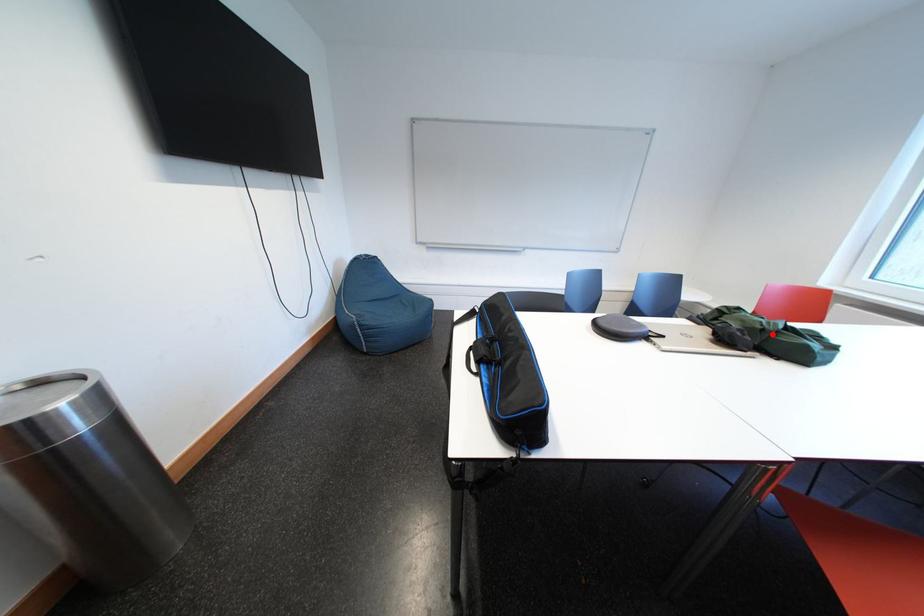
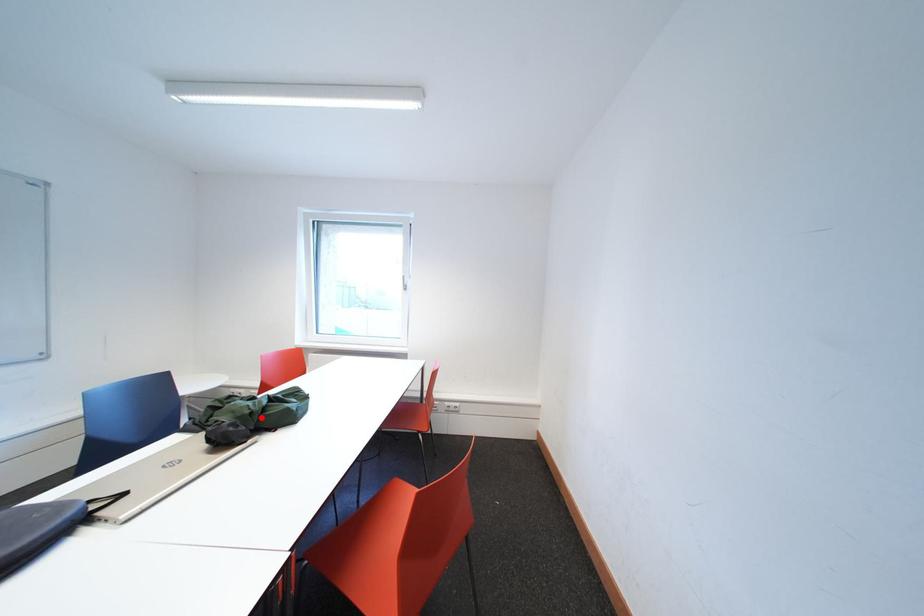
I am providing you with two images of the same scene from different viewpoints. A red point is marked on the first image and another point is marked on the second image. Are the points marked in image1 and image2 representing the same 3D position?

Yes